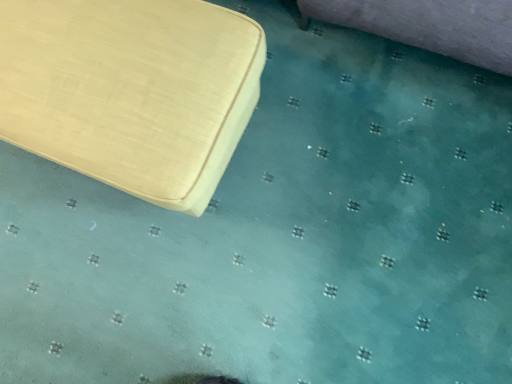
This screenshot has height=384, width=512. What do you see at coordinates (131, 91) in the screenshot?
I see `light wood/finely polished table at upper left` at bounding box center [131, 91].

You are a GUI agent. You are given a task and a screenshot of the screen. Output one action in this format:
    pyautogui.click(x=<x>, y=<y>)
    Task: Click on the light wood/finely polished table at upper left
    
    Given the screenshot: What is the action you would take?
    pyautogui.click(x=131, y=91)

This screenshot has width=512, height=384. Find the location of `light wood/finely polished table at upper left`. light wood/finely polished table at upper left is located at coordinates (131, 91).